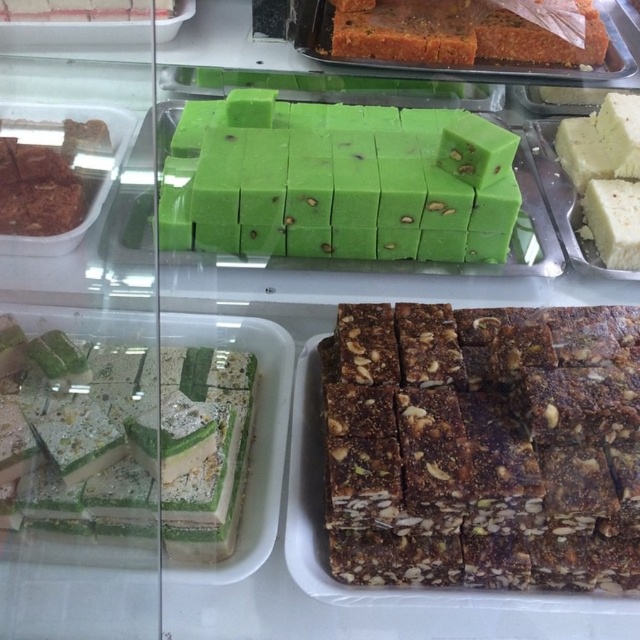
At what (x,y) coordinates should I click in order to perform the action: click on dark brown crumbly bar at center. Please return your answer as a coordinate pair (x, y). This screenshot has height=640, width=640. Looking at the image, I should click on (483, 445).

Does dark brown crumbly bar at center come behind green soft candy at center?

That is False.

Between point (516, 506) and point (186, 106), which one is positioned in front?

Point (516, 506)

Where is `dark brown crumbly bar at center`? dark brown crumbly bar at center is located at coordinates (483, 445).

Does point (449, 145) lie behind point (32, 419)?

Yes, it is.

Between green soft candy at center and green textured cake at lower left, which one has less height?

green textured cake at lower left is shorter.

This screenshot has width=640, height=640. In order to click on green soft candy at center in this screenshot , I will do `click(339, 184)`.

This screenshot has width=640, height=640. Identify the location of green soft candy at center. (339, 184).

Is point (236, 401) positioned in front of point (595, 227)?

Yes.

Between green textured cake at lower left and white creamy cake at right, which one has more height?

white creamy cake at right is taller.

Who is more forward, (216, 401) or (556, 138)?

→ Point (216, 401) is more forward.

The width and height of the screenshot is (640, 640). Identify the location of green textured cake at lower left. (125, 442).